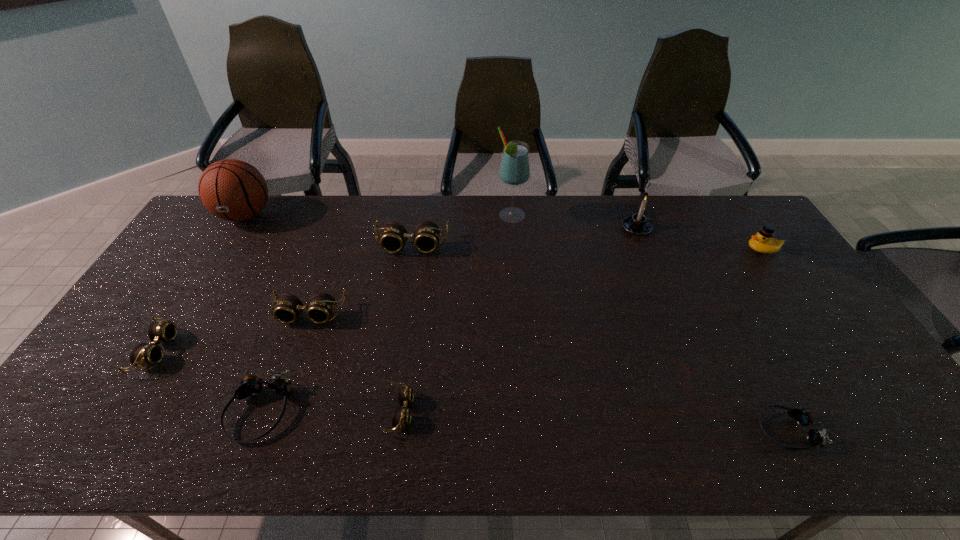
Identify the location of free location that satisfies the following two spatial constraints: 1. with a handle on the side of the eighth object from left to right; 2. through the lenses of the bigger bronze goggles. (709, 411).